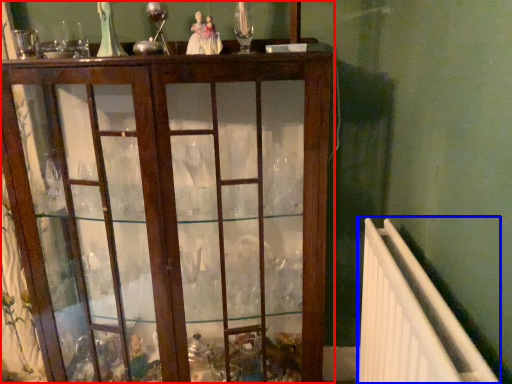
Question: Among these objects, which one is nearest to the camera, furniture (highlighted by a red box) or radiator (highlighted by a blue box)?

Choices:
 (A) furniture
 (B) radiator

Answer: (B)